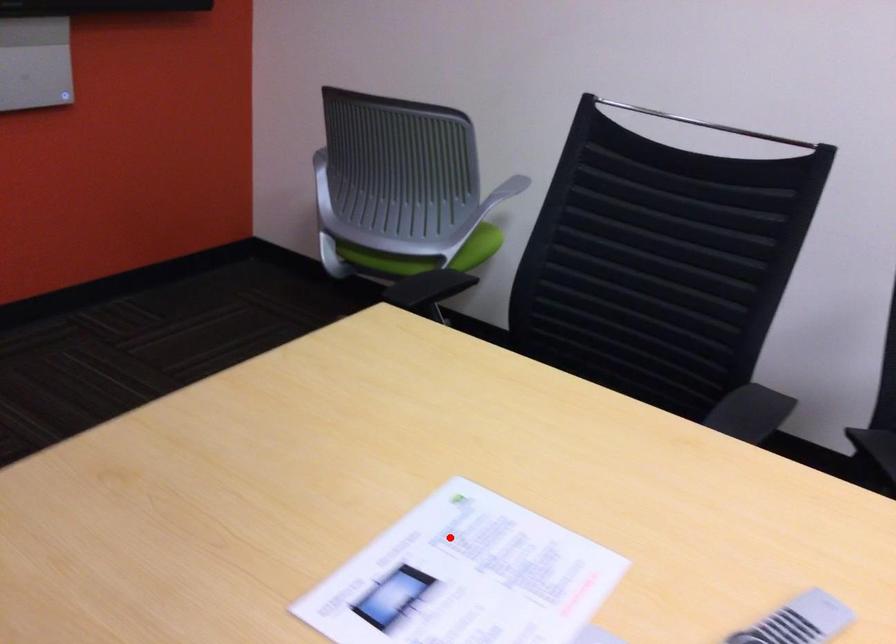
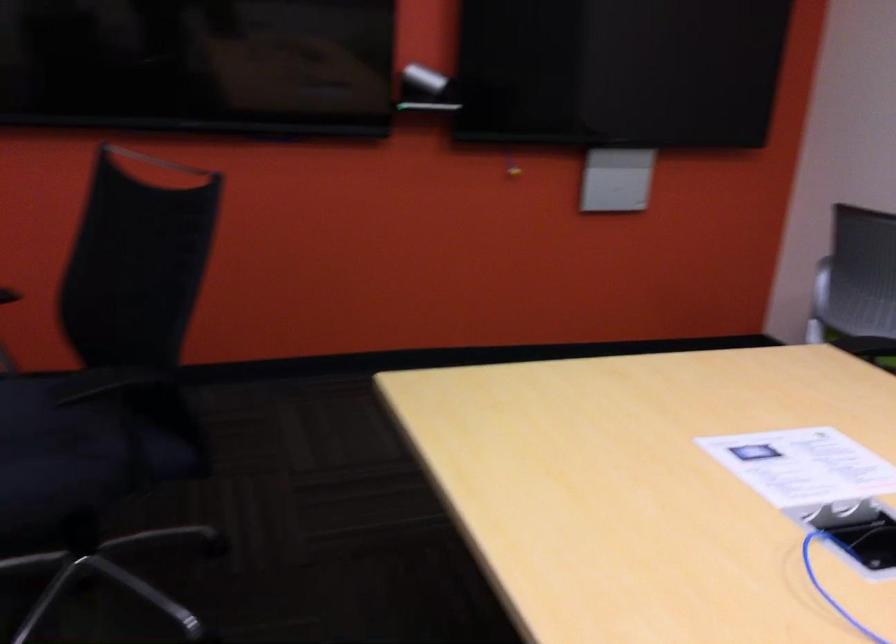
Where in the second image is the point corresponding to the highlighted location from the first image?

(803, 466)